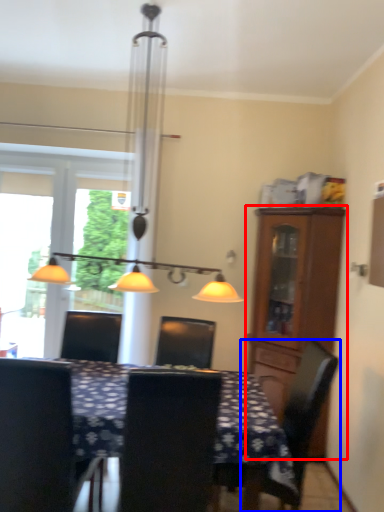
Question: Which of the following is the closest to the observer, cabinetry (highlighted by a red box) or chair (highlighted by a blue box)?

Choices:
 (A) cabinetry
 (B) chair

Answer: (B)